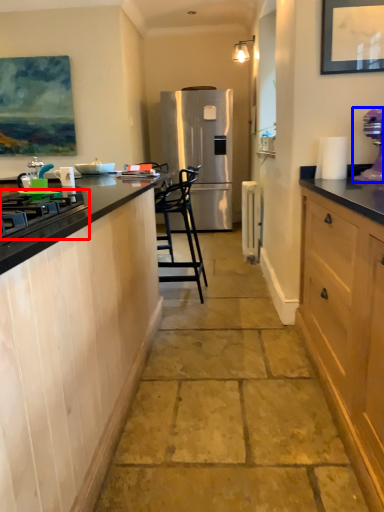
Question: Which of the following is the closest to the observer, gas stove (highlighted by a red box) or kitchen appliance (highlighted by a blue box)?

Choices:
 (A) gas stove
 (B) kitchen appliance

Answer: (A)